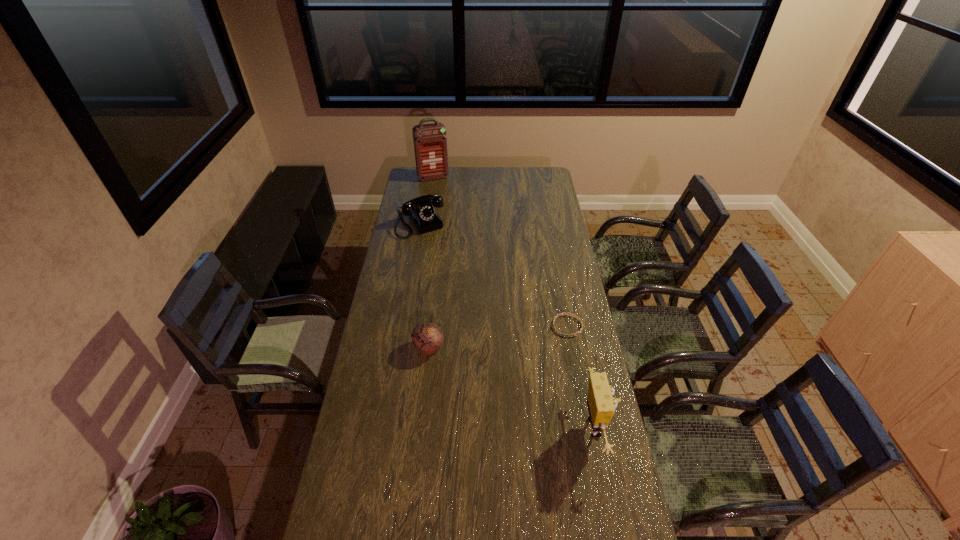
The height and width of the screenshot is (540, 960). In order to click on vacant space that satisfies the following two spatial constraints: 1. on the front side of the tallest object; 2. on the left side of the bracelet in this screenshot , I will do `click(411, 326)`.

Where is `vacant area in the image that satisfies the following two spatial constraints: 1. on the front side of the second shortest object; 2. on the face of the sponge`? This screenshot has height=540, width=960. vacant area in the image that satisfies the following two spatial constraints: 1. on the front side of the second shortest object; 2. on the face of the sponge is located at coordinates (420, 427).

Identify the location of vacant space that satisfies the following two spatial constraints: 1. on the front side of the sponge; 2. on the face of the fourth nearest object. (387, 427).

At what (x,y) coordinates should I click in order to perform the action: click on vacant space that satisfies the following two spatial constraints: 1. on the back side of the first-aid kit; 2. on the right side of the third tallest object. Please return your answer as a coordinate pair (x, y). The width and height of the screenshot is (960, 540). Looking at the image, I should click on click(428, 178).